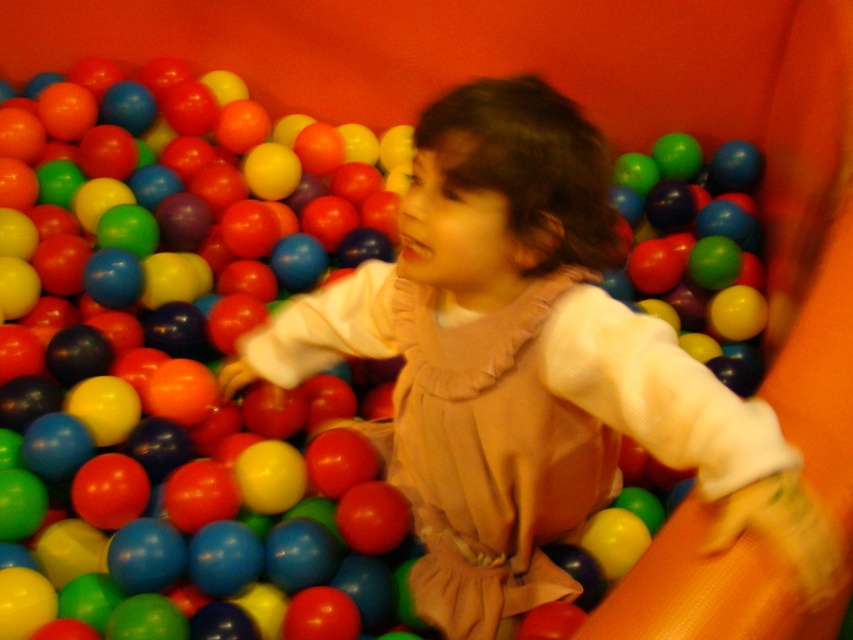
You are a parent trying to ensure your child stays safe in the ball pit. You notice the matte beige dress at center and the matte plastic ball at upper center. Which object is located higher in the ball pit?

The matte plastic ball at upper center is higher in the ball pit because it is positioned above the matte beige dress at center.

Based on the photo, you are a parent watching your child play in the ball pit. You notice the orange rubber slide at right and the matte plastic ball at upper center. Which object is positioned higher in the image?

The matte plastic ball at upper center is positioned higher than the orange rubber slide at right.